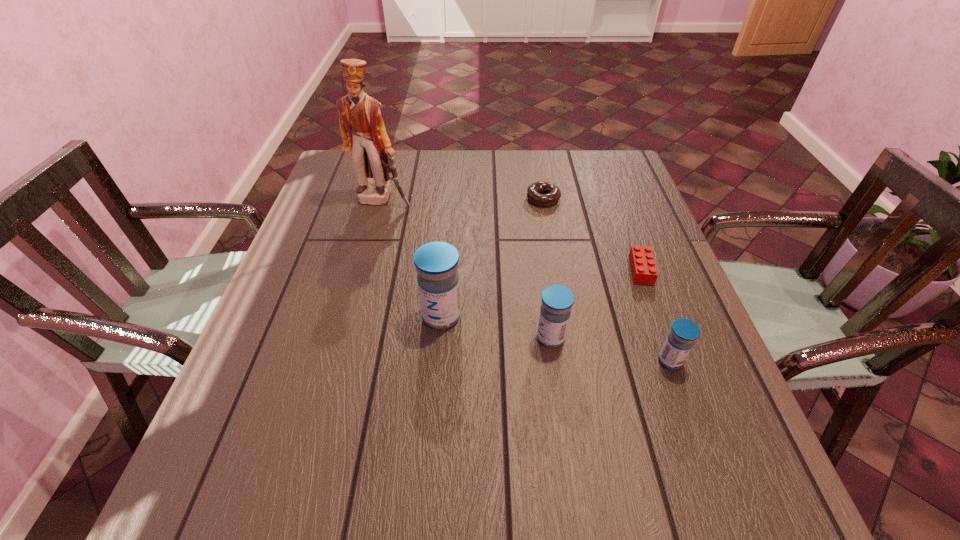
This screenshot has height=540, width=960. I want to click on Lego located at the right edge, so click(642, 263).

This screenshot has height=540, width=960. Identify the location of object that is at the far left corner. (363, 131).

The width and height of the screenshot is (960, 540). I want to click on blank space at the far edge, so click(454, 164).

Locate an element on the screen. The width and height of the screenshot is (960, 540). vacant space at the near edge is located at coordinates (561, 435).

Locate an element on the screen. vacant point at the left edge is located at coordinates (300, 307).

Where is `free space at the right edge of the desktop`? free space at the right edge of the desktop is located at coordinates (657, 376).

In the image, there is a desktop. Identify the location of vacant area at the far left corner. (337, 163).

At what (x,y) coordinates should I click in order to perform the action: click on vacant space at the far right corner. Please return your answer as a coordinate pair (x, y). The width and height of the screenshot is (960, 540). Looking at the image, I should click on (590, 186).

This screenshot has height=540, width=960. What are the coordinates of `vacant point at the near right corner` in the screenshot? It's located at (724, 423).

The width and height of the screenshot is (960, 540). In order to click on free spot between the nearest medicine and the doughnut in this screenshot , I will do `click(607, 280)`.